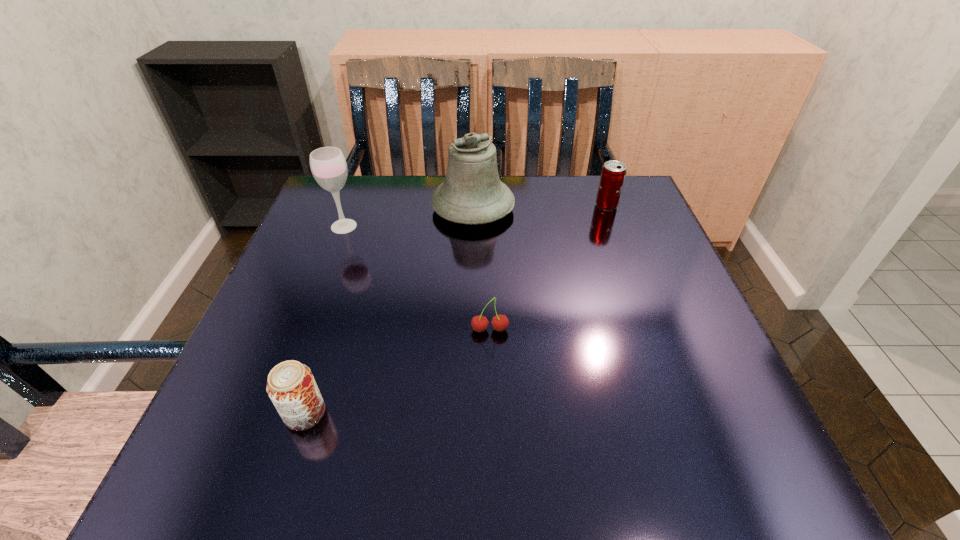
This screenshot has height=540, width=960. I want to click on blank area located 0.060m on the front of the right beer can, so click(x=614, y=227).

Locate an element on the screen. Image resolution: width=960 pixels, height=540 pixels. vacant space located 0.120m on the right of the nearest object is located at coordinates (403, 413).

The height and width of the screenshot is (540, 960). I want to click on vacant space located on the surface of the shortest object, so click(492, 413).

I want to click on bell present at the far edge, so click(472, 193).

The image size is (960, 540). I want to click on wineglass located in the far edge section of the desktop, so point(328,165).

The image size is (960, 540). Find the location of `beer can at the far edge`. beer can at the far edge is located at coordinates (613, 173).

Find the location of a particular element. The width and height of the screenshot is (960, 540). object located in the near edge section of the desktop is located at coordinates (291, 386).

The width and height of the screenshot is (960, 540). Identify the location of wineglass situated at the left edge. (328, 165).

Where is `beer can located in the left edge section of the desktop`? The width and height of the screenshot is (960, 540). beer can located in the left edge section of the desktop is located at coordinates (291, 386).

This screenshot has height=540, width=960. Find the location of `object present at the right edge`. object present at the right edge is located at coordinates (613, 173).